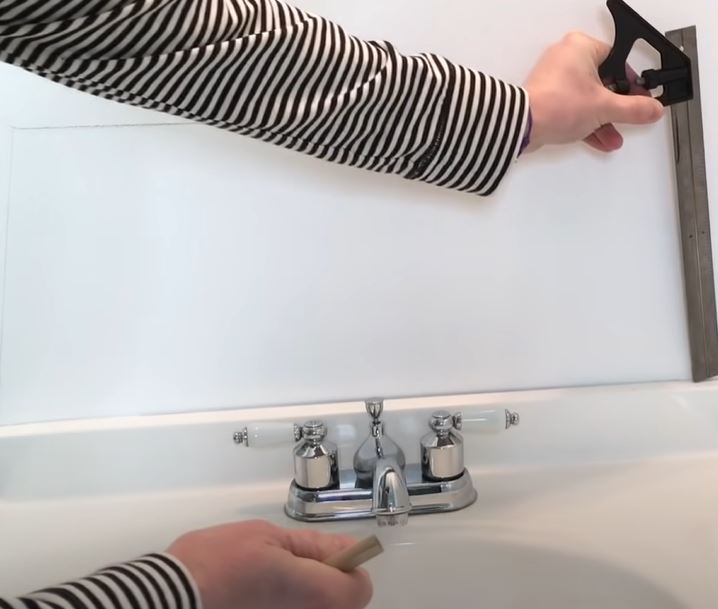
The height and width of the screenshot is (609, 718). In order to click on sink basin in this screenshot , I will do `click(456, 580)`.